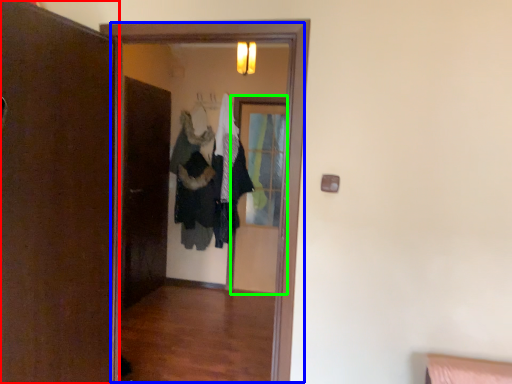
Question: Considering the real-world distances, which object is farthest from door (highlighted by a red box)? screen door (highlighted by a blue box) or screen door (highlighted by a green box)?

Choices:
 (A) screen door
 (B) screen door

Answer: (B)